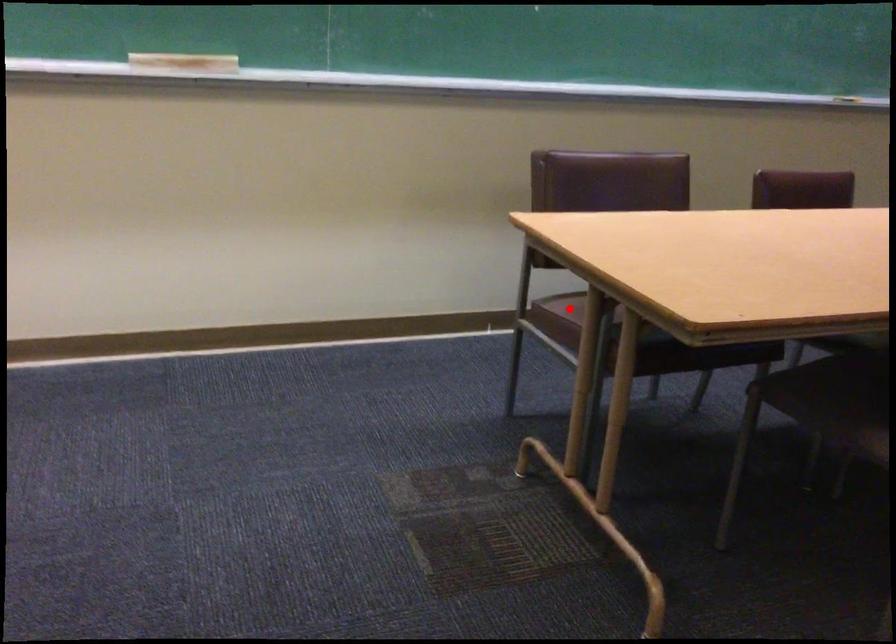
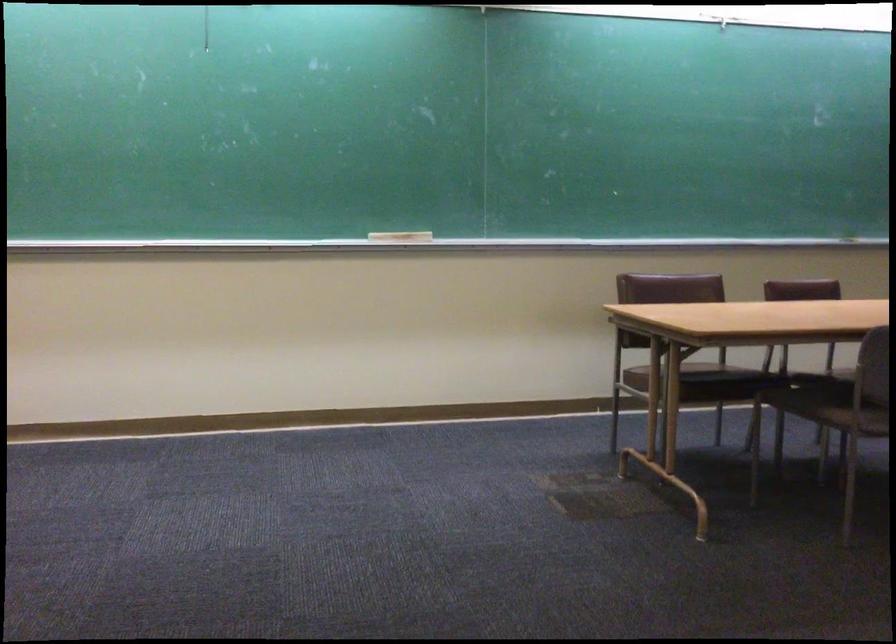
In the second image, find the point that corresponds to the highlighted location in the first image.

(648, 368)